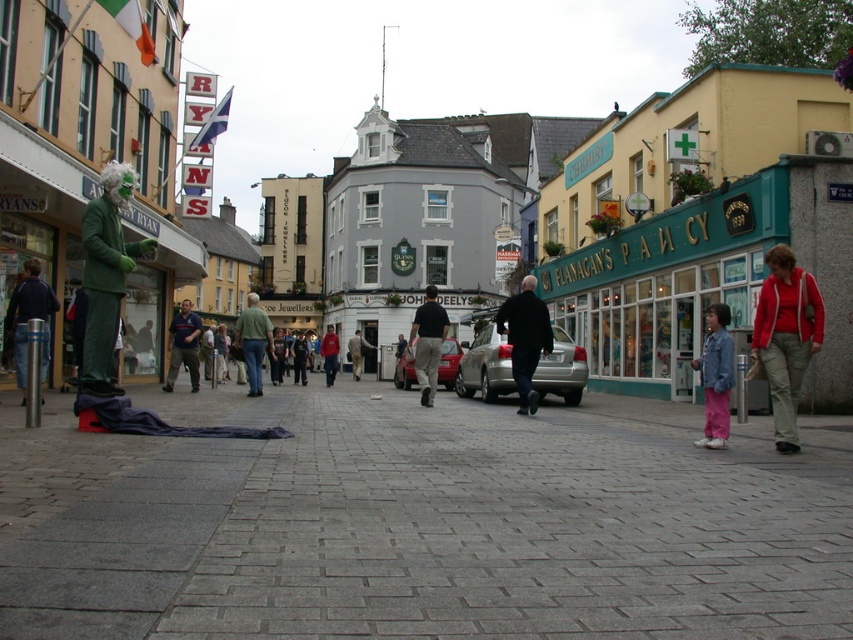
Question: Estimate the real-world distances between objects in this image. Which object is closer to the dark blue shirt at center?

Choices:
 (A) green fabric jacket at center
 (B) red cotton jacket at lower right

Answer: (A)

Question: Observing the image, what is the correct spatial positioning of denim jacket at lower right in reference to metallic silver car at center?

Choices:
 (A) above
 (B) below

Answer: (A)

Question: Is dark gray pants at center to the right of metallic silver car at center from the viewer's perspective?

Choices:
 (A) no
 (B) yes

Answer: (A)

Question: Which point is farther to the camera?

Choices:
 (A) dark gray pants at center
 (B) dark blue shirt at center

Answer: (B)

Question: Considering the real-world distances, which object is closest to the green fabric jacket at center?

Choices:
 (A) dark blue shirt at center
 (B) gray stone pavement at center
 (C) dark blue jacket at center
 (D) dark gray pants at center

Answer: (A)

Question: Is dark gray pants at center positioned before dark blue shirt at center?

Choices:
 (A) yes
 (B) no

Answer: (A)